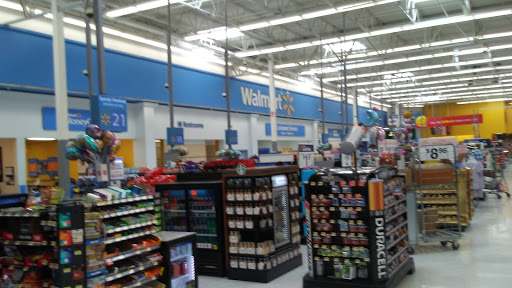
The height and width of the screenshot is (288, 512). What are the coordinates of `mylar balloons` in the screenshot? It's located at (74, 154), (68, 147), (84, 145), (95, 131), (100, 143), (106, 140), (116, 146), (113, 159).